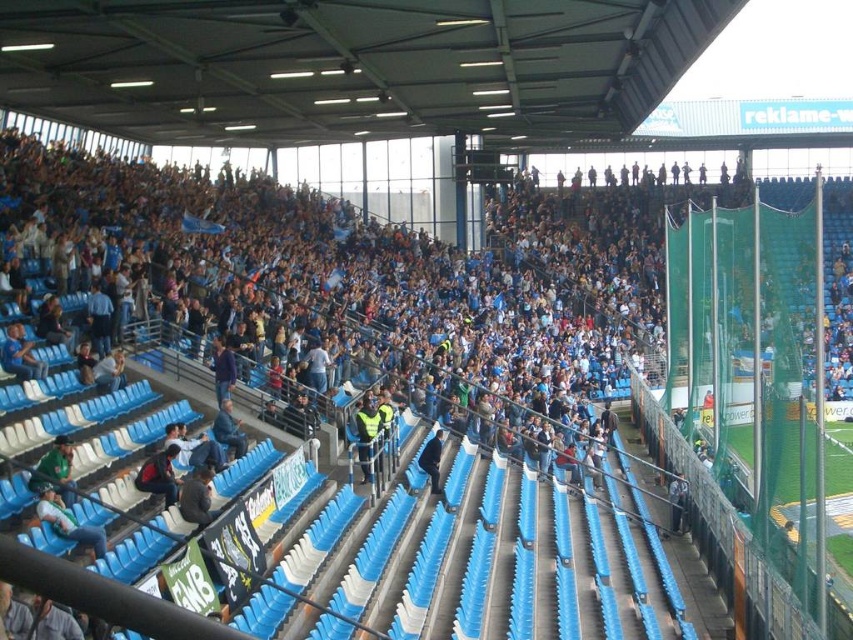
Question: Is dark gray jacket at lower left above dark blue jacket at center?

Choices:
 (A) no
 (B) yes

Answer: (A)

Question: Which point is closer to the camera taking this photo?

Choices:
 (A) (90, 531)
 (B) (227, 435)
 (C) (106, 385)
 (D) (65, 497)

Answer: (A)

Question: Observing the image, what is the correct spatial positioning of matte black jacket at lower left in reference to dark blue jacket at center?

Choices:
 (A) above
 (B) below

Answer: (B)

Question: Can you confirm if yellow reflective vest at center is wider than dark blue fabric jacket at center?

Choices:
 (A) yes
 (B) no

Answer: (A)

Question: Which object appears closest to the camera in this image?

Choices:
 (A) light blue fabric jacket at lower left
 (B) light blue plastic seat at lower left

Answer: (B)

Question: Which object is farther from the camera taking this photo?

Choices:
 (A) light blue plastic seat at lower left
 (B) dark blue jacket at lower right
 (C) light blue fabric jacket at lower left
 (D) dark blue fabric jacket at center

Answer: (B)